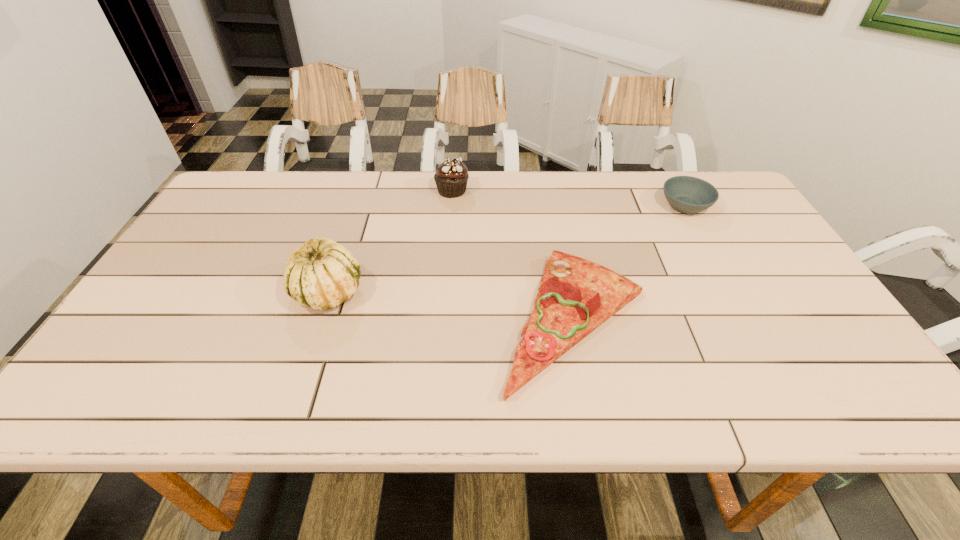
Locate an element on the screen. the tallest object is located at coordinates (322, 274).

Image resolution: width=960 pixels, height=540 pixels. Identify the location of the leftmost object. (322, 274).

At what (x,y) coordinates should I click in order to perform the action: click on cupcake. Please return your answer as a coordinate pair (x, y). Looking at the image, I should click on (451, 178).

Where is `the third object from right to left`? Image resolution: width=960 pixels, height=540 pixels. the third object from right to left is located at coordinates [x=451, y=178].

What are the coordinates of `soup bowl` in the screenshot? It's located at (686, 194).

At what (x,y) coordinates should I click in order to perform the action: click on the third object from left to right. Please return your answer as a coordinate pair (x, y). Looking at the image, I should click on (x=576, y=296).

In order to click on vacant space located on the right of the gourd in this screenshot , I will do `click(389, 292)`.

Where is `vacant area situated on the right of the cupcake`? vacant area situated on the right of the cupcake is located at coordinates (588, 191).

Image resolution: width=960 pixels, height=540 pixels. Find the location of `blank space located on the back of the soup bowl`. blank space located on the back of the soup bowl is located at coordinates (669, 178).

The width and height of the screenshot is (960, 540). In order to click on vacant region located on the left of the pizza in this screenshot , I will do `click(421, 319)`.